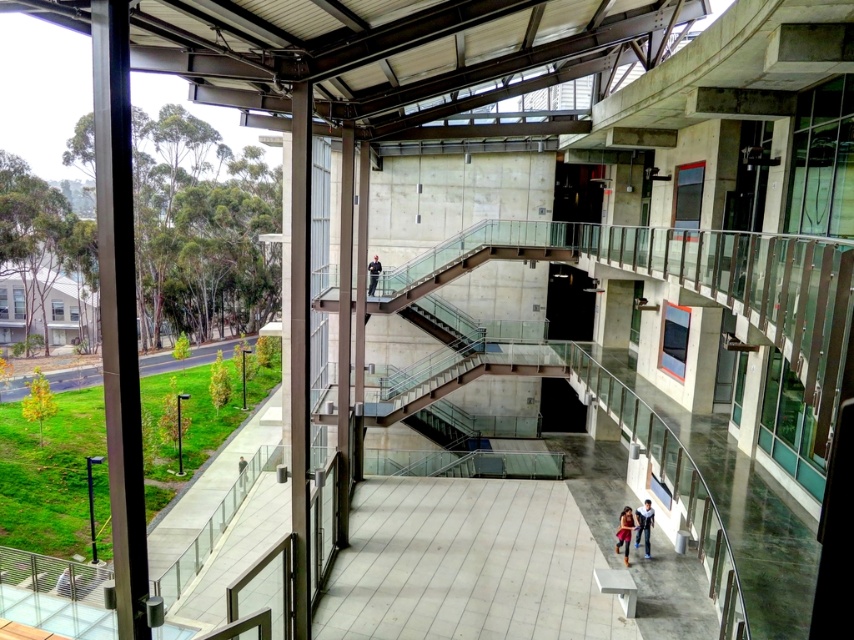
Question: In this image, where is blue jeans at lower center located relative to dark blue uniform at center?

Choices:
 (A) right
 (B) left

Answer: (A)

Question: Which of the following is the farthest from the observer?

Choices:
 (A) matte black jacket at lower center
 (B) blue jeans at lower center

Answer: (B)

Question: Considering the relative positions of matte black jacket at lower center and dark blue uniform at center in the image provided, where is matte black jacket at lower center located with respect to dark blue uniform at center?

Choices:
 (A) below
 (B) above

Answer: (A)

Question: Estimate the real-world distances between objects in this image. Which object is closer to the blue jeans at lower center?

Choices:
 (A) dark blue uniform at center
 (B) matte black jacket at lower center

Answer: (B)

Question: Considering the relative positions of matte black jacket at lower center and dark blue uniform at center in the image provided, where is matte black jacket at lower center located with respect to dark blue uniform at center?

Choices:
 (A) below
 (B) above

Answer: (A)

Question: Which point is closer to the camera?

Choices:
 (A) (373, 289)
 (B) (648, 529)

Answer: (B)